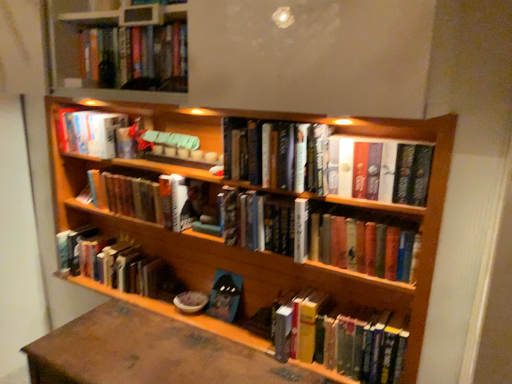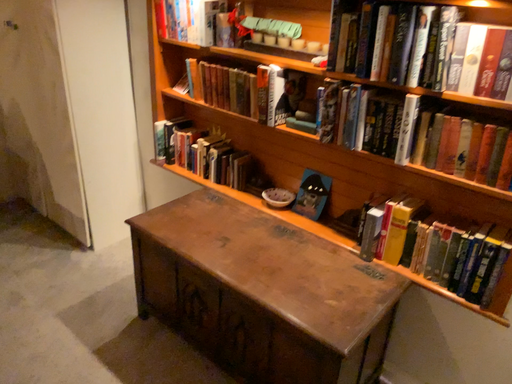
Question: How did the camera likely rotate when shooting the video?

Choices:
 (A) rotated downward
 (B) rotated upward

Answer: (A)